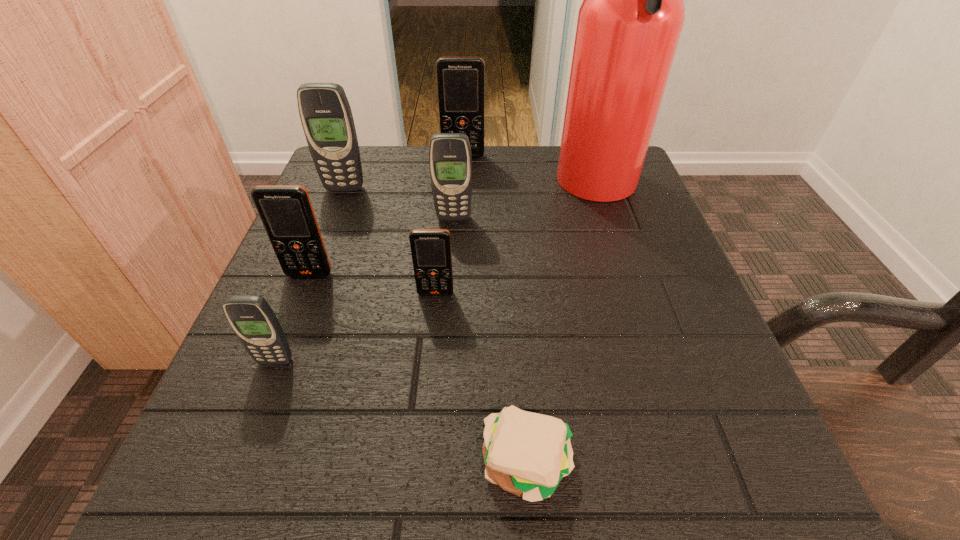
Where is `vacant space that's between the shortest object and the farthest gray cellular telephone`? This screenshot has height=540, width=960. vacant space that's between the shortest object and the farthest gray cellular telephone is located at coordinates (436, 326).

Locate an element on the screen. This screenshot has width=960, height=540. vacant point located between the fourth nearest object and the second smallest gray cellular telephone is located at coordinates (381, 246).

You are a GUI agent. You are given a task and a screenshot of the screen. Output one action in this format:
    pyautogui.click(x=<x>, y=<y>)
    Task: Click on the free point between the fire extinguisher and the nearest object
    Image resolution: width=960 pixels, height=540 pixels.
    Given the screenshot: What is the action you would take?
    pyautogui.click(x=563, y=326)

This screenshot has height=540, width=960. I want to click on vacant area that lies between the smallest orange cellular telephone and the second farthest orange cellular telephone, so click(x=372, y=284).

Locate an element on the screen. free space between the biggest gray cellular telephone and the shortest object is located at coordinates (436, 326).

Choose which object is the nearest neighbor to the farthest cellular telephone. Please provide its 2D coordinates. Your answer should be formatted as a tuple, i.e. [(x, y)], where the tuple contains the x and y coordinates of a point satisfying the conditions above.

[(629, 24)]

Identify the location of object that is the nearest to the nearest object. This screenshot has height=540, width=960. [x=430, y=248].

You are a GUI agent. You are given a task and a screenshot of the screen. Output one action in this format:
    pyautogui.click(x=<x>, y=<y>)
    Task: Click on the fourth closest cellular telephone to the nearest cellular telephone
    
    Given the screenshot: What is the action you would take?
    pyautogui.click(x=326, y=116)

Where is `cellular telephone that stands as the fourth closest to the third nearest cellular telephone`? The width and height of the screenshot is (960, 540). cellular telephone that stands as the fourth closest to the third nearest cellular telephone is located at coordinates (326, 116).

I want to click on orange cellular telephone identified as the third closest to the smallest gray cellular telephone, so tap(460, 80).